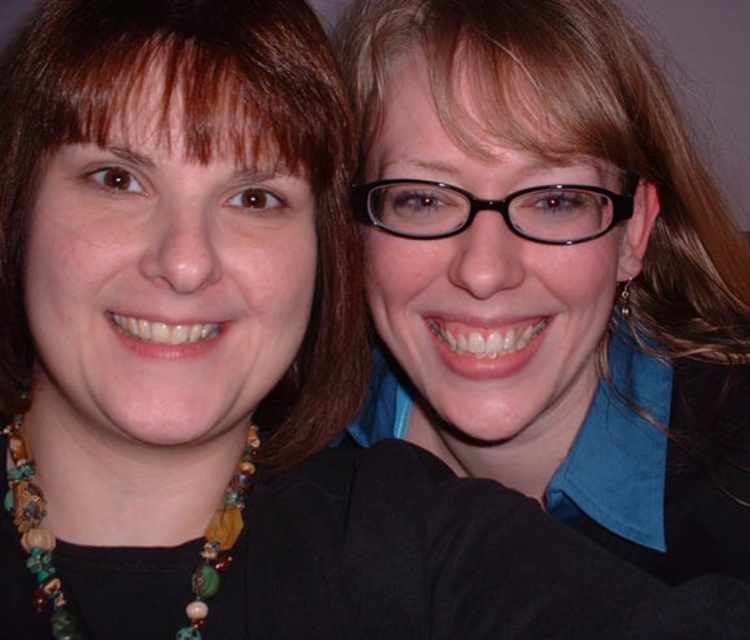
Question: Which object is farther from the camera taking this photo?

Choices:
 (A) multicolored beaded necklace at lower left
 (B) black plastic glasses at center
 (C) brown hair at left

Answer: (B)

Question: Can you confirm if brown hair at left is smaller than multicolored beaded necklace at lower left?

Choices:
 (A) no
 (B) yes

Answer: (A)

Question: Can you confirm if black plastic glasses at center is positioned to the left of multicolored beaded necklace at lower left?

Choices:
 (A) no
 (B) yes

Answer: (A)

Question: Is matte black hair at upper right positioned behind black plastic glasses at center?

Choices:
 (A) yes
 (B) no

Answer: (B)

Question: Which of the following is the closest to the observer?

Choices:
 (A) (18, 260)
 (B) (522, 131)
 (C) (68, 616)
 (D) (492, 205)

Answer: (C)

Question: Which object is positioned farthest from the black plastic glasses at center?

Choices:
 (A) brown hair at left
 (B) multicolored beaded necklace at lower left

Answer: (B)